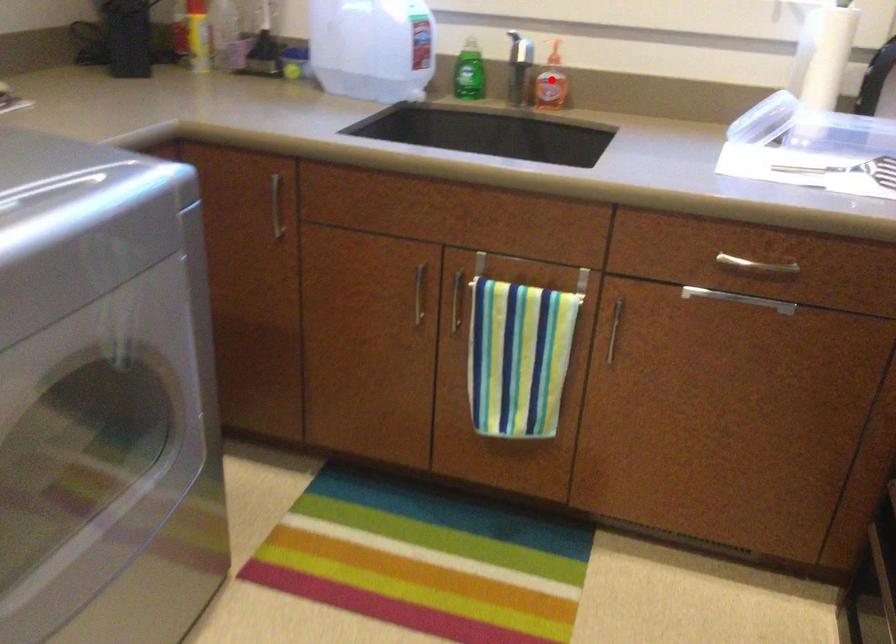
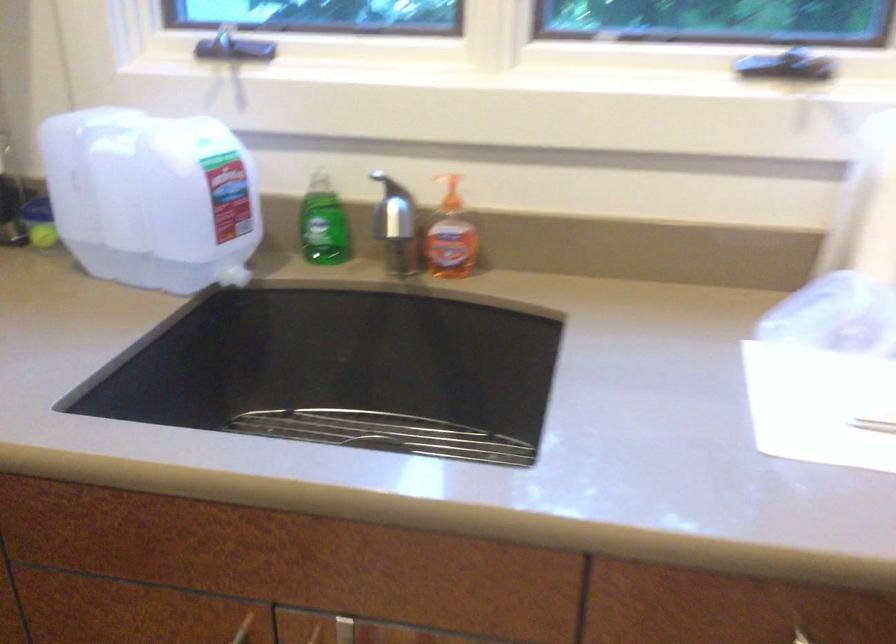
Question: I am providing you with two images of the same scene from different viewpoints. In image1, a red point is highlighted. Considering the same 3D point in image2, which of the following is correct?

Choices:
 (A) It is closer
 (B) It is farther

Answer: (A)